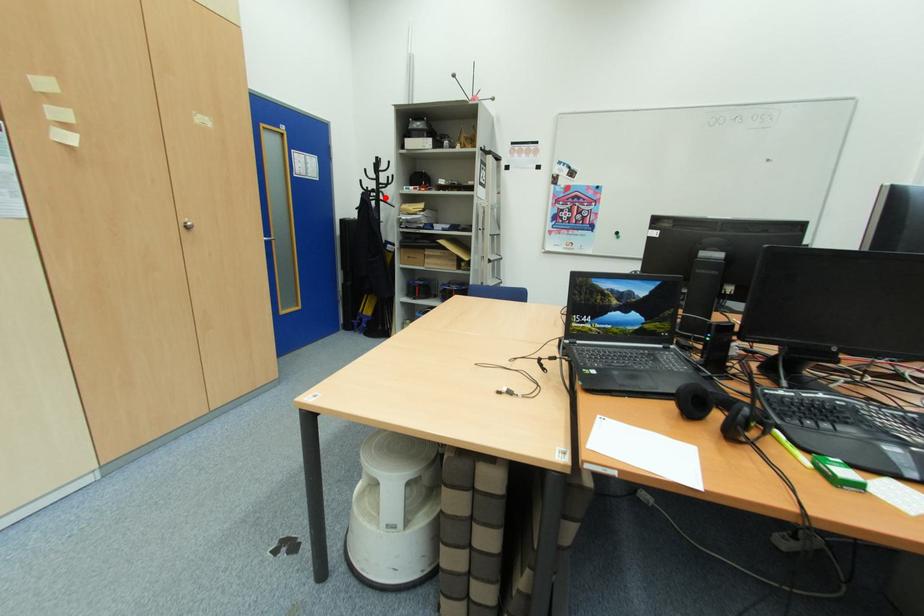
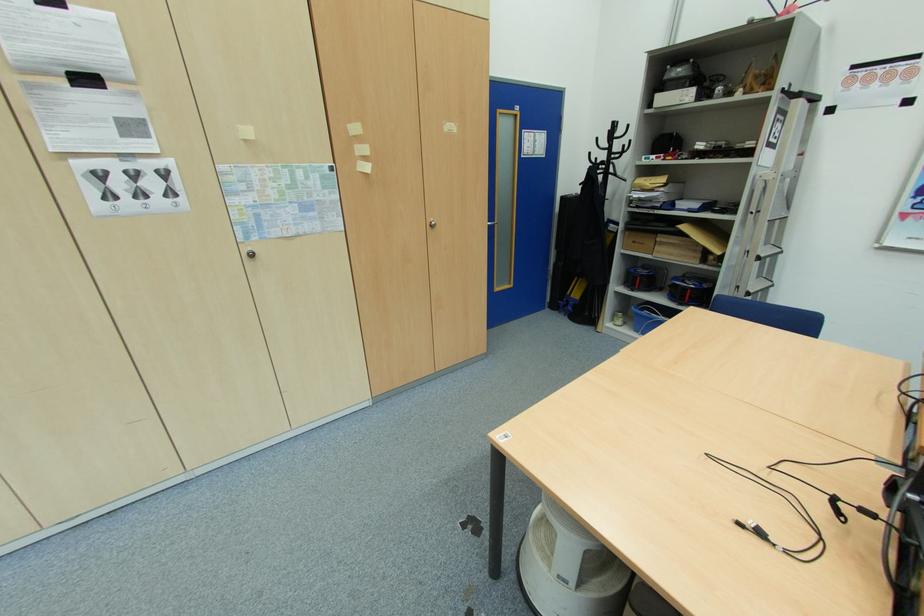
Find the pixel in the second image that matches the highlighted location in the first image.

(614, 169)